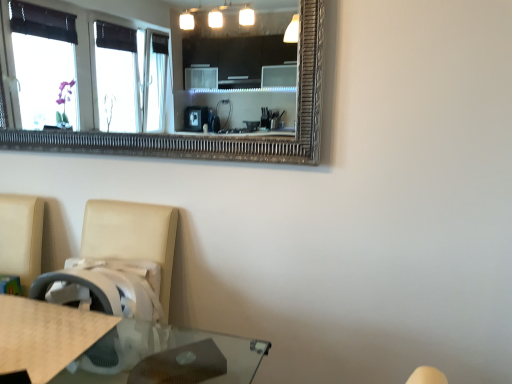
Question: Should I look upward or downward to see beige textured mat at lower left?

Choices:
 (A) up
 (B) down

Answer: (B)

Question: Is beige textured mat at lower left facing towards beige leather swivel chair at lower left?

Choices:
 (A) yes
 (B) no

Answer: (A)

Question: From the image's perspective, would you say beige textured mat at lower left is positioned over beige leather swivel chair at lower left?

Choices:
 (A) no
 (B) yes

Answer: (B)

Question: Is beige textured mat at lower left not within beige leather swivel chair at lower left?

Choices:
 (A) no
 (B) yes

Answer: (A)

Question: Is beige textured mat at lower left oriented away from beige leather swivel chair at lower left?

Choices:
 (A) yes
 (B) no

Answer: (A)

Question: Can you confirm if beige textured mat at lower left is positioned to the left of beige leather swivel chair at lower left?

Choices:
 (A) yes
 (B) no

Answer: (A)

Question: Considering the relative sizes of beige textured mat at lower left and beige leather swivel chair at lower left in the image provided, is beige textured mat at lower left smaller than beige leather swivel chair at lower left?

Choices:
 (A) yes
 (B) no

Answer: (A)

Question: Is beige leather swivel chair at lower left taller than beige textured mat at lower left?

Choices:
 (A) no
 (B) yes

Answer: (B)

Question: Is beige leather swivel chair at lower left outside beige textured mat at lower left?

Choices:
 (A) yes
 (B) no

Answer: (A)

Question: Would you say beige leather swivel chair at lower left is a long distance from beige textured mat at lower left?

Choices:
 (A) yes
 (B) no

Answer: (B)

Question: From a real-world perspective, is beige leather swivel chair at lower left physically above beige textured mat at lower left?

Choices:
 (A) no
 (B) yes

Answer: (A)

Question: Is beige textured mat at lower left a part of beige leather swivel chair at lower left?

Choices:
 (A) no
 (B) yes

Answer: (B)

Question: Could you tell me if beige leather swivel chair at lower left is turned towards beige textured mat at lower left?

Choices:
 (A) no
 (B) yes

Answer: (B)

Question: From a real-world perspective, is beige leather swivel chair at lower left positioned above or below beige textured mat at lower left?

Choices:
 (A) below
 (B) above

Answer: (A)